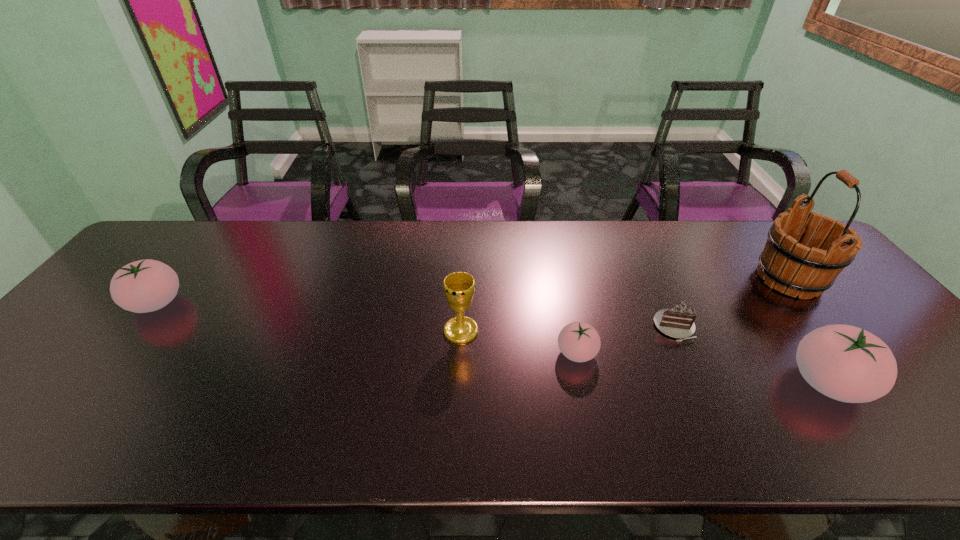
In the image, there is a desktop. Where is `free space at the far edge`? free space at the far edge is located at coordinates [x=197, y=264].

Where is `vacant space at the near edge`? This screenshot has height=540, width=960. vacant space at the near edge is located at coordinates (115, 392).

This screenshot has width=960, height=540. Identify the location of free space at the far left corner. (170, 222).

You are a GUI agent. You are given a task and a screenshot of the screen. Output one action in this format:
    pyautogui.click(x=<x>, y=<y>)
    Task: Click on the vacant space in between the leftmost object and the shortest object
    The width and height of the screenshot is (960, 540).
    Given the screenshot: What is the action you would take?
    pyautogui.click(x=416, y=315)

Where is `free area in between the second shortest object and the leftmost tomato`? The height and width of the screenshot is (540, 960). free area in between the second shortest object and the leftmost tomato is located at coordinates (367, 328).

Find the location of `empty location between the shortest tomato and the second tallest tomato`. empty location between the shortest tomato and the second tallest tomato is located at coordinates (367, 328).

You are a GUI agent. You are given a task and a screenshot of the screen. Output one action in this format:
    pyautogui.click(x=<x>, y=<y>)
    Task: Click on the free space that is in between the shortest object and the rightmost tomato
    
    Given the screenshot: What is the action you would take?
    pyautogui.click(x=751, y=355)

Where is `vacant area between the second tomato from left to right and the second tallest tomato`? vacant area between the second tomato from left to right and the second tallest tomato is located at coordinates point(367,328).

This screenshot has height=540, width=960. Find the location of `free space between the tallest object and the chalice`. free space between the tallest object and the chalice is located at coordinates (625, 305).

I want to click on vacant area that lies between the tallest object and the chalice, so click(625, 305).